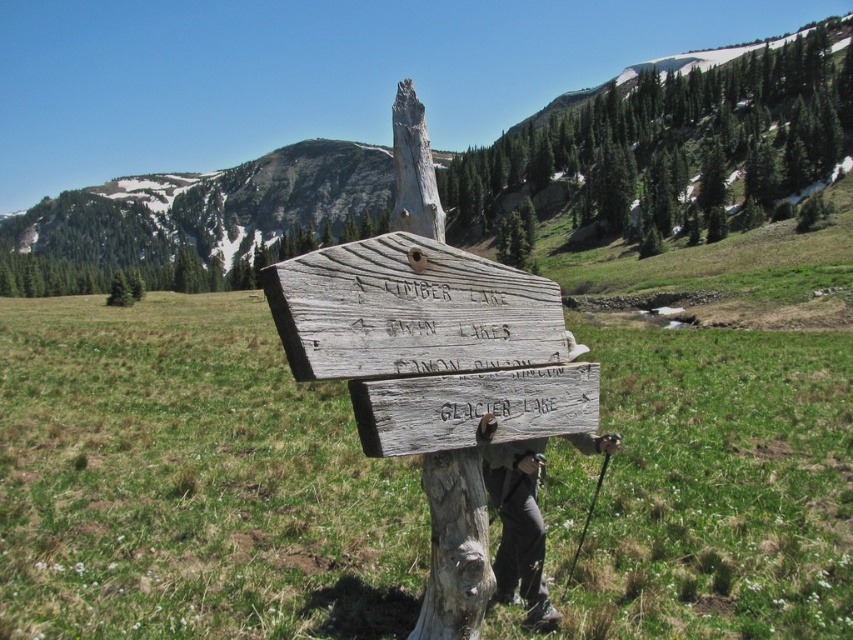
Is point (393, 300) closer to camera compared to point (469, 618)?

Yes, point (393, 300) is closer to viewer.

Does weathered wood sign at center have a greater height compared to weathered wood tree trunk at center?

No.

Where is `weathered wood sign at center`? Image resolution: width=853 pixels, height=640 pixels. weathered wood sign at center is located at coordinates (409, 310).

Does point (506, 317) come closer to viewer compared to point (521, 467)?

Yes, point (506, 317) is in front of point (521, 467).

From the picture: Who is more forward, (329,262) or (495,566)?

Positioned in front is point (329,262).

You are a GUI agent. You are given a task and a screenshot of the screen. Output one action in this format:
    pyautogui.click(x=<x>, y=<y>)
    Task: Click on the weathered wood sign at center
    The image size is (853, 640).
    Given the screenshot: What is the action you would take?
    pyautogui.click(x=409, y=310)

Does gray wood signpost at center lie in front of green textured tree at upper center?

No, gray wood signpost at center is behind green textured tree at upper center.

Who is shorter, gray wood signpost at center or green textured tree at upper center?

Standing shorter between the two is green textured tree at upper center.

Which is in front, point (131, 195) or point (485, 220)?

Point (485, 220) is in front.

Locate an element on the screen. The image size is (853, 640). gray wood signpost at center is located at coordinates (193, 214).